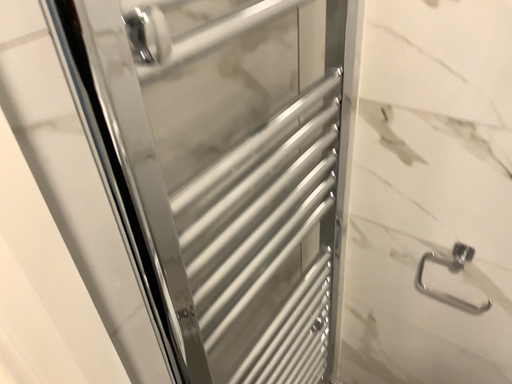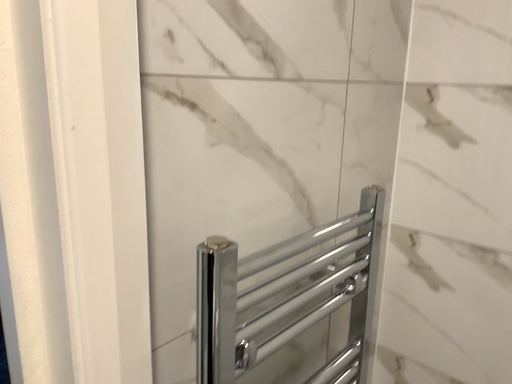
Question: How did the camera likely rotate when shooting the video?

Choices:
 (A) rotated upward
 (B) rotated downward

Answer: (A)